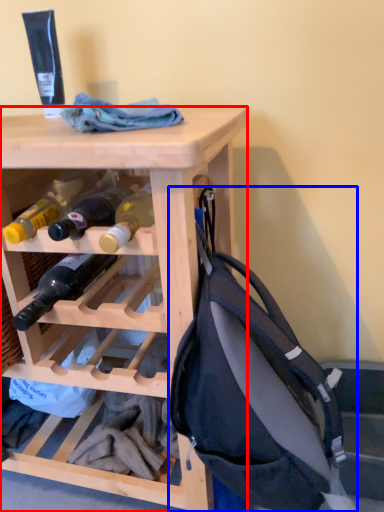
Question: Which object appears farthest to the camera in this image, desk (highlighted by a red box) or backpack (highlighted by a blue box)?

Choices:
 (A) desk
 (B) backpack

Answer: (A)